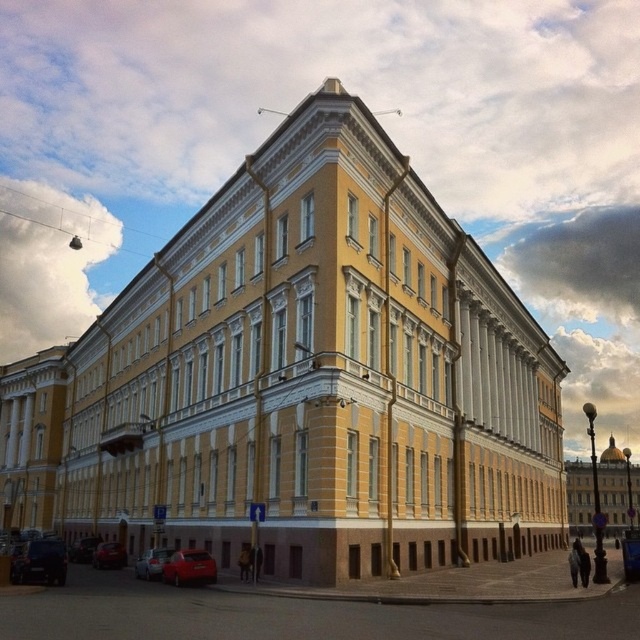
You are a delivery person needing to park a 2.5 meter wide truck between the matte red car at lower left and the metallic red car at lower left. Can you fit the truck between them?

The distance between the matte red car at lower left and the metallic red car at lower left is 14.47 meters. Since the truck is only 2.5 meters wide, there is more than enough space to park it between them.